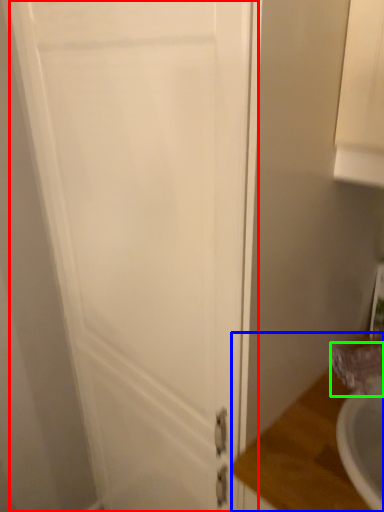
Question: Which object is the closest to the door (highlighted by a red box)? Choose among these: counter top (highlighted by a blue box) or faucet (highlighted by a green box).

Choices:
 (A) counter top
 (B) faucet

Answer: (A)